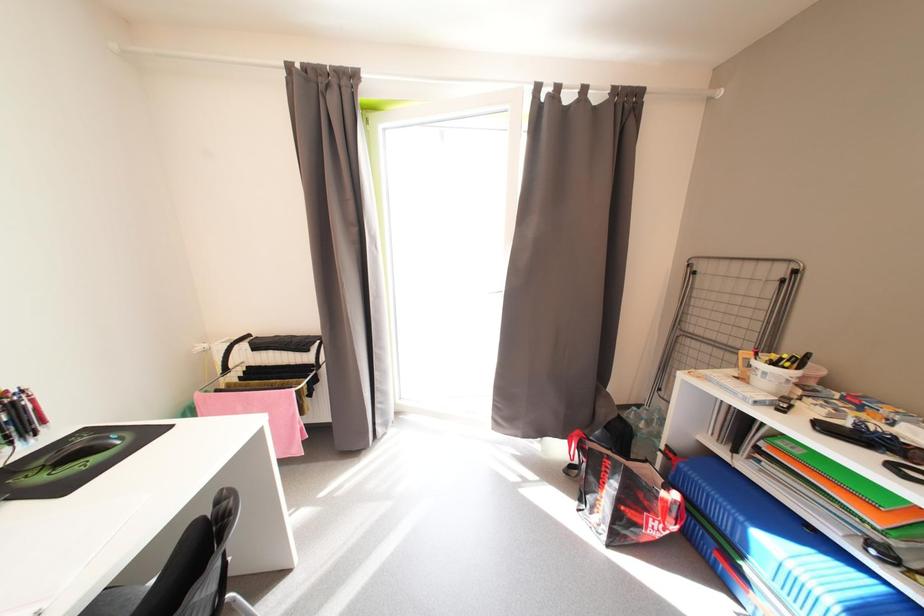
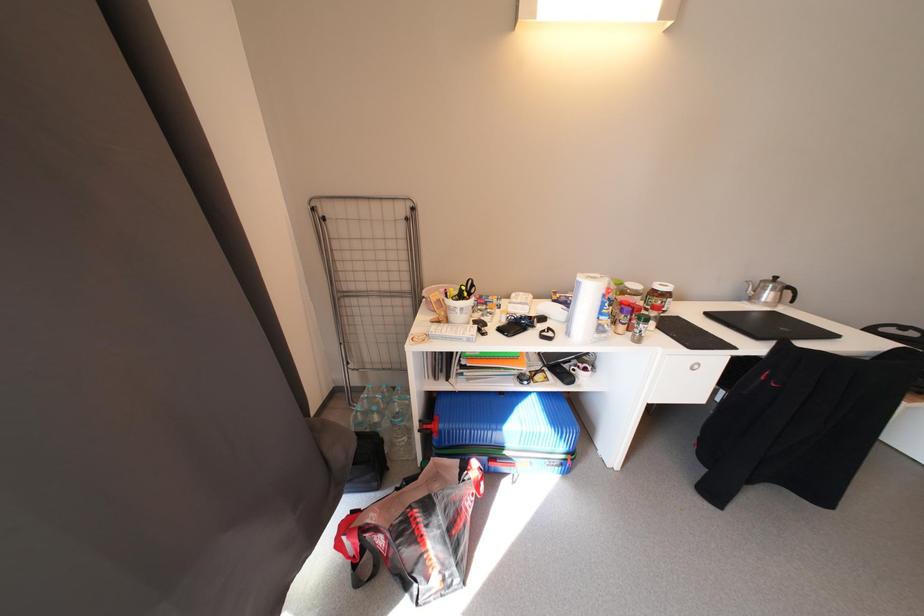
The images are taken continuously from a first-person perspective. In which direction is your viewpoint rotating?

The camera rotated toward right-down.